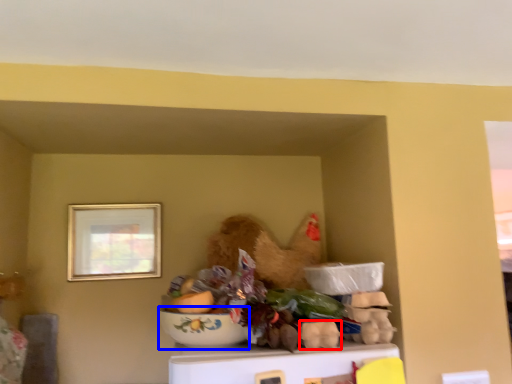
Question: Which object is further to the camera taking this photo, food (highlighted by a red box) or bowl (highlighted by a blue box)?

Choices:
 (A) food
 (B) bowl

Answer: (A)